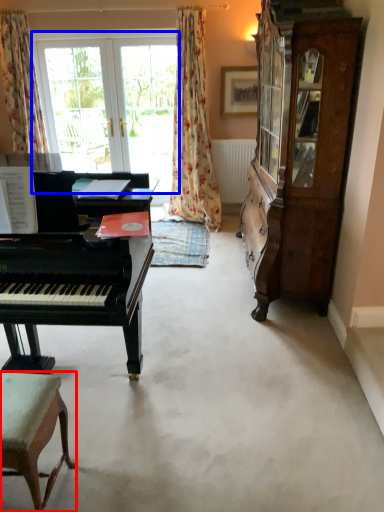
Question: Which object is closer to the camera taking this photo, chair (highlighted by a red box) or bay window (highlighted by a blue box)?

Choices:
 (A) chair
 (B) bay window

Answer: (A)